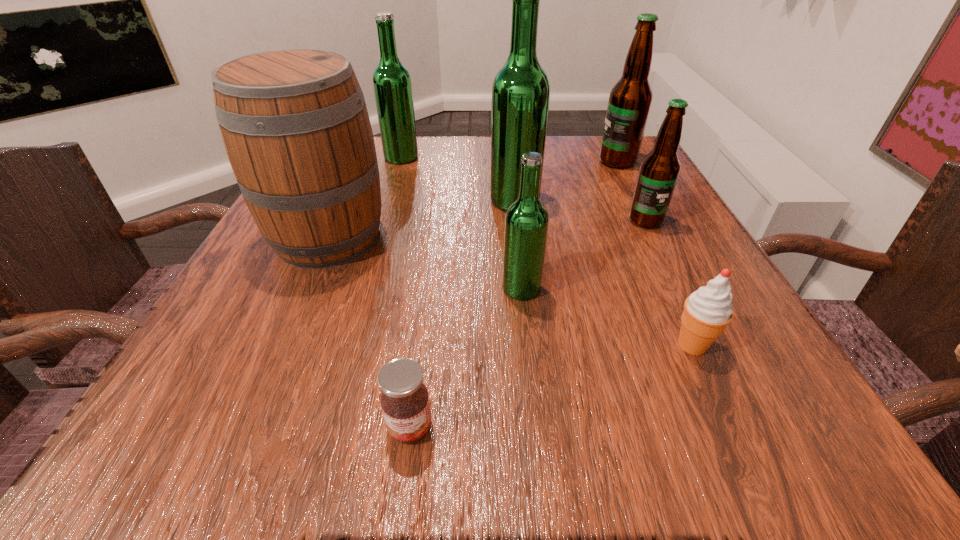
You are a GUI agent. You are given a task and a screenshot of the screen. Output one action in this format:
    pyautogui.click(x=<x>, y=<y>)
    Task: Click on the free spot located 0.140m on the front of the smallest green beer bottle
    Image resolution: width=960 pixels, height=540 pixels.
    Given the screenshot: What is the action you would take?
    point(531,378)

Where is `free point located 0.180m on the back of the second shortest object`? The image size is (960, 540). free point located 0.180m on the back of the second shortest object is located at coordinates (649, 252).

Find the location of a particular element. object present at the near edge is located at coordinates (405, 403).

Identify the location of object that is at the left edge. (294, 122).

At what (x,y) coordinates should I click in order to perform the action: click on icecream positioned at the right edge. Please return your answer as a coordinate pair (x, y). Looking at the image, I should click on (707, 311).

I want to click on object that is at the far right corner, so click(x=630, y=99).

The width and height of the screenshot is (960, 540). I want to click on vacant space at the far edge of the desktop, so click(x=579, y=172).

Image resolution: width=960 pixels, height=540 pixels. In the image, there is a desktop. In order to click on vacant space at the near edge in this screenshot , I will do `click(676, 436)`.

In the image, there is a desktop. Where is `vacant space at the left edge`? This screenshot has width=960, height=540. vacant space at the left edge is located at coordinates (276, 274).

In the image, there is a desktop. Where is `vacant region at the right edge`? This screenshot has height=540, width=960. vacant region at the right edge is located at coordinates (615, 188).